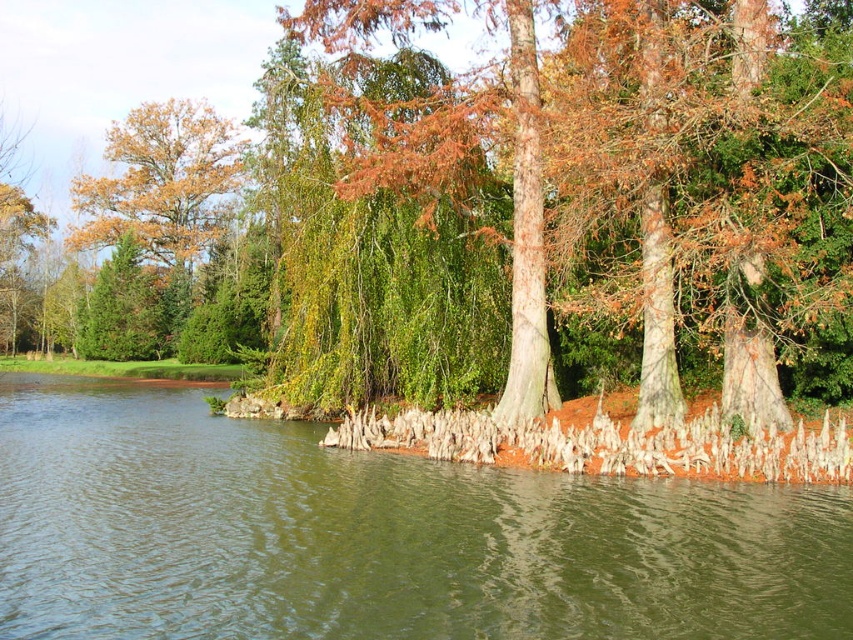
You are standing on the edge of the water and see the green smooth water at center and the smooth bark tree at center. Which object is closer to you?

The green smooth water at center is closer to you because it is positioned under the smooth bark tree at center, meaning the water is in front of the tree.

You are a hiker who wants to cross the green smooth water at center using a 50 meter long rope. The golden oak tree at upper left has a sturdy branch. Can you tie the rope to the tree and reach the other side of the water?

The distance between the green smooth water at center and the golden oak tree at upper left is 57.40 meters. Since the rope is only 50 meters long, it is not long enough to span the distance. Therefore, you cannot tie the rope to the golden oak tree at upper left and reach the other side of the water.

You are an ecologist studying the arrangement of trees in this natural setting. You observe the smooth bark tree at center and the golden oak tree at upper left. Which tree is located to the right of the other?

The smooth bark tree at center is positioned on the right side of golden oak tree at upper left, so the smooth bark tree at center is to the right of the golden oak tree at upper left.